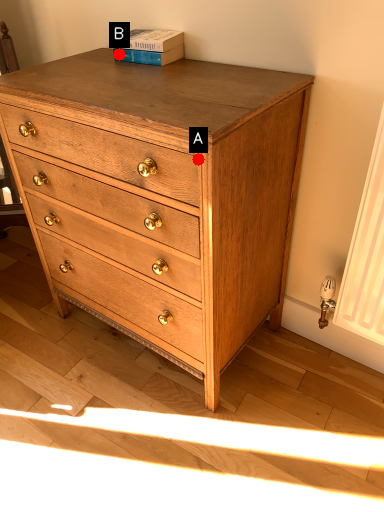
Question: Two points are circled on the image, labeled by A and B beside each circle. Which point is further to the camera?

Choices:
 (A) A is further
 (B) B is further

Answer: (B)